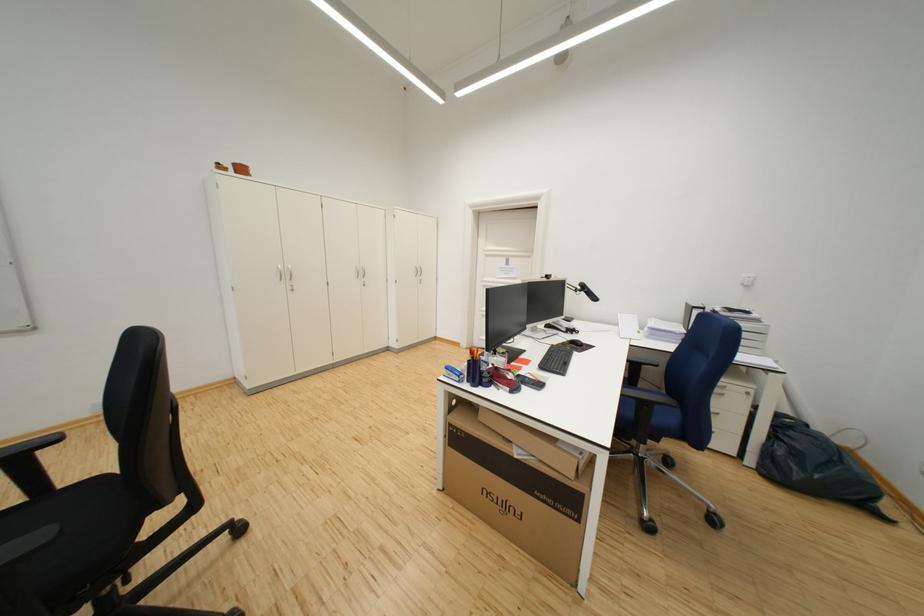
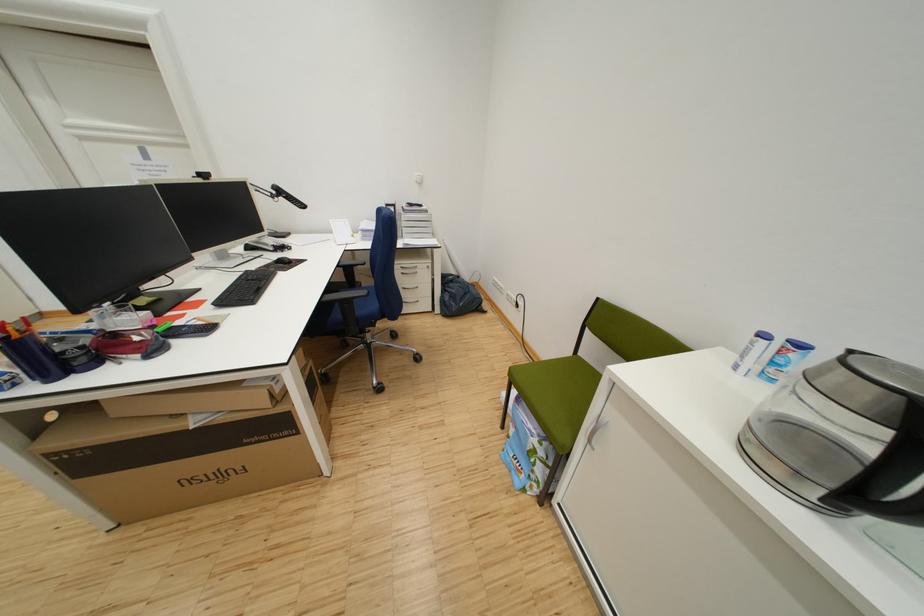
How did the camera likely rotate?

The rotation direction of the camera is right-down.